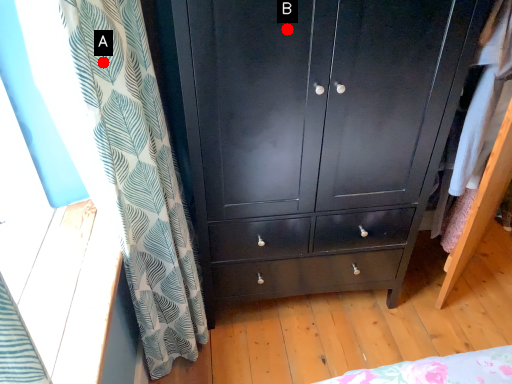
Question: Two points are circled on the image, labeled by A and B beside each circle. Which point is further to the camera?

Choices:
 (A) A is further
 (B) B is further

Answer: (B)